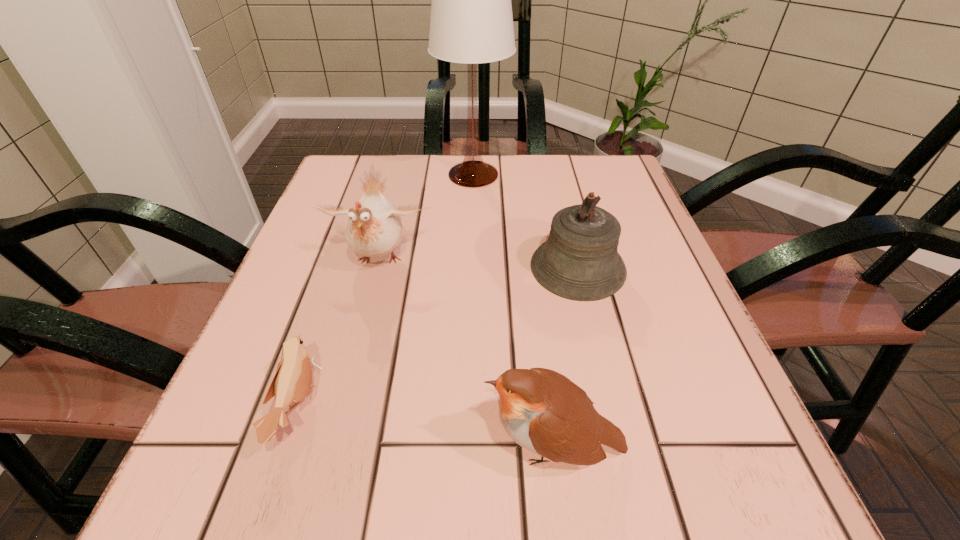
You are a GUI agent. You are given a task and a screenshot of the screen. Output one action in this format:
    pyautogui.click(x=<x>, y=<y>)
    Task: Click on the free location that satisfies the following two spatial constraints: 1. at the beak of the farthest bird; 2. at the beak of the shortest object
    The width and height of the screenshot is (960, 540).
    Given the screenshot: What is the action you would take?
    pyautogui.click(x=342, y=407)

Image resolution: width=960 pixels, height=540 pixels. In order to click on vacant area in the image that satisfies the following two spatial constraints: 1. above the cylindrical shade of the table lamp; 2. at the beak of the farthest bird in this screenshot , I will do `click(471, 261)`.

The image size is (960, 540). What are the coordinates of `vacant space that satisfies the following two spatial constraints: 1. on the front side of the bell; 2. at the beak of the shortest object` in the screenshot? It's located at (612, 407).